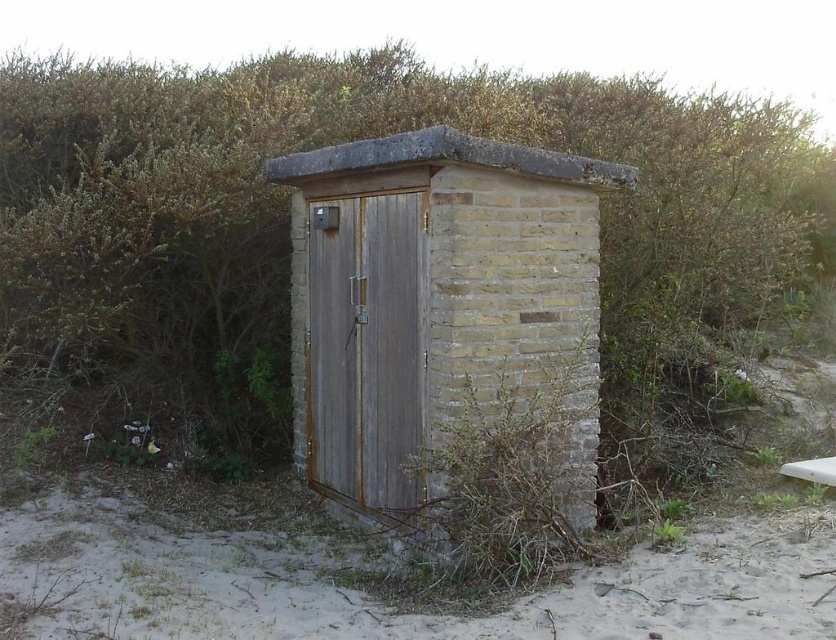
You are standing in front of the rusty wood hut at center and want to move to the green leafy hedge at center. Which direction should you walk to reach the hedge?

The green leafy hedge at center is to the left of the rusty wood hut at center, so you should walk to the left to reach the hedge.

You are standing in front of the rusty wood hut at center and want to see the view behind it. Can you see the green leafy hedge at center from your current position?

The green leafy hedge at center is shorter than the rusty wood hut at center, so you cannot see the green leafy hedge at center from your current position in front of the rusty wood hut at center because it is blocked by the taller structure.